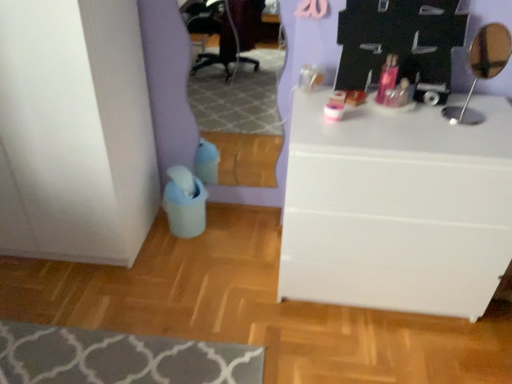
Question: Can you confirm if white matte chest of drawers at center is taller than gray textured rug at lower left?

Choices:
 (A) yes
 (B) no

Answer: (A)

Question: From a real-world perspective, is white matte chest of drawers at center physically below gray textured rug at lower left?

Choices:
 (A) yes
 (B) no

Answer: (B)

Question: Does white matte chest of drawers at center have a lesser height compared to gray textured rug at lower left?

Choices:
 (A) yes
 (B) no

Answer: (B)

Question: Can you confirm if white matte chest of drawers at center is positioned to the left of gray textured rug at lower left?

Choices:
 (A) yes
 (B) no

Answer: (B)

Question: Is white matte chest of drawers at center smaller than gray textured rug at lower left?

Choices:
 (A) no
 (B) yes

Answer: (A)

Question: From the image's perspective, is white matte chest of drawers at center on top of gray textured rug at lower left?

Choices:
 (A) no
 (B) yes

Answer: (B)

Question: Is metallic silver mirror at upper right positioned with its back to white matte chest of drawers at center?

Choices:
 (A) yes
 (B) no

Answer: (B)

Question: From the image's perspective, does metallic silver mirror at upper right appear higher than white matte chest of drawers at center?

Choices:
 (A) no
 (B) yes

Answer: (B)

Question: Is white matte chest of drawers at center a part of metallic silver mirror at upper right?

Choices:
 (A) no
 (B) yes

Answer: (A)

Question: Is metallic silver mirror at upper right bigger than white matte chest of drawers at center?

Choices:
 (A) yes
 (B) no

Answer: (B)

Question: Considering the relative sizes of metallic silver mirror at upper right and white matte chest of drawers at center in the image provided, is metallic silver mirror at upper right taller than white matte chest of drawers at center?

Choices:
 (A) yes
 (B) no

Answer: (B)

Question: Is metallic silver mirror at upper right shorter than white matte chest of drawers at center?

Choices:
 (A) no
 (B) yes

Answer: (B)

Question: Is gray textured rug at lower left positioned beyond the bounds of white matte chest of drawers at center?

Choices:
 (A) yes
 (B) no

Answer: (A)